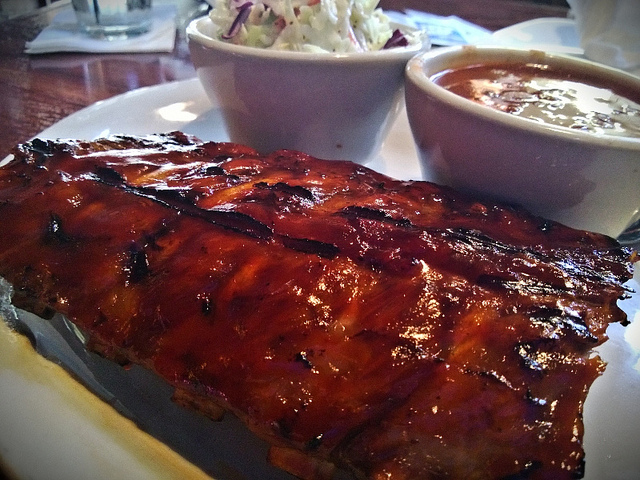
This screenshot has height=480, width=640. I want to click on napkin under glass, so click(x=68, y=39).